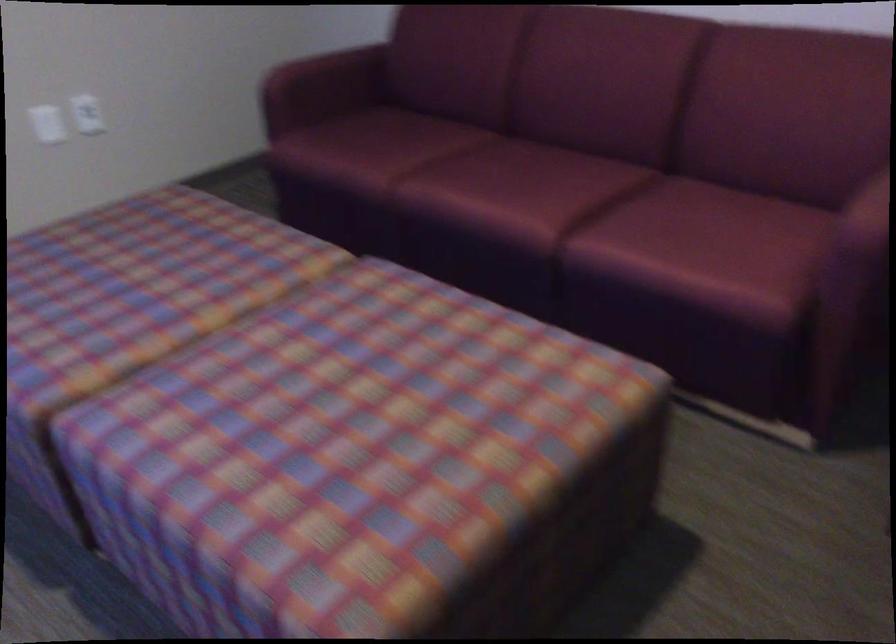
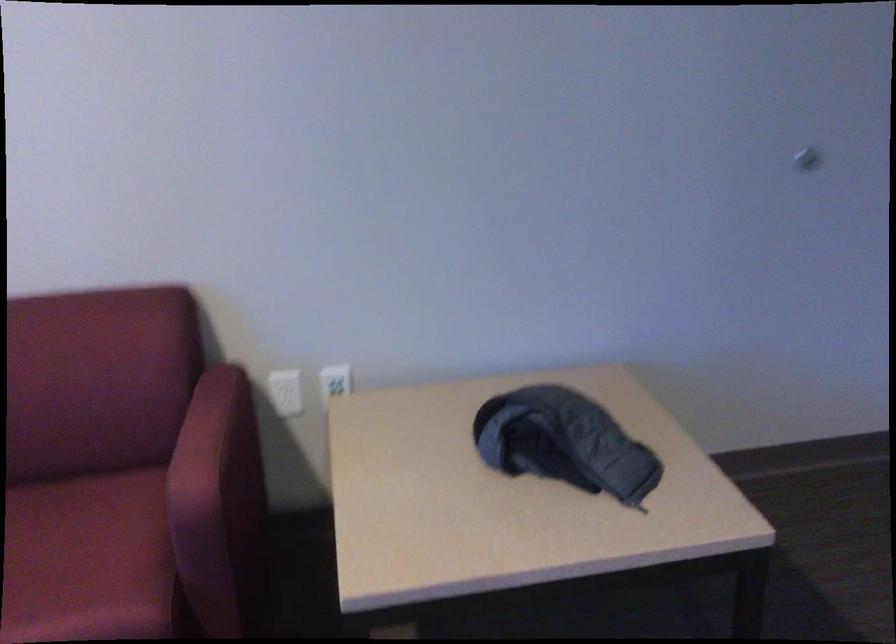
Find the pixel in the second image that matches point 746,249 in the first image.

(88, 560)